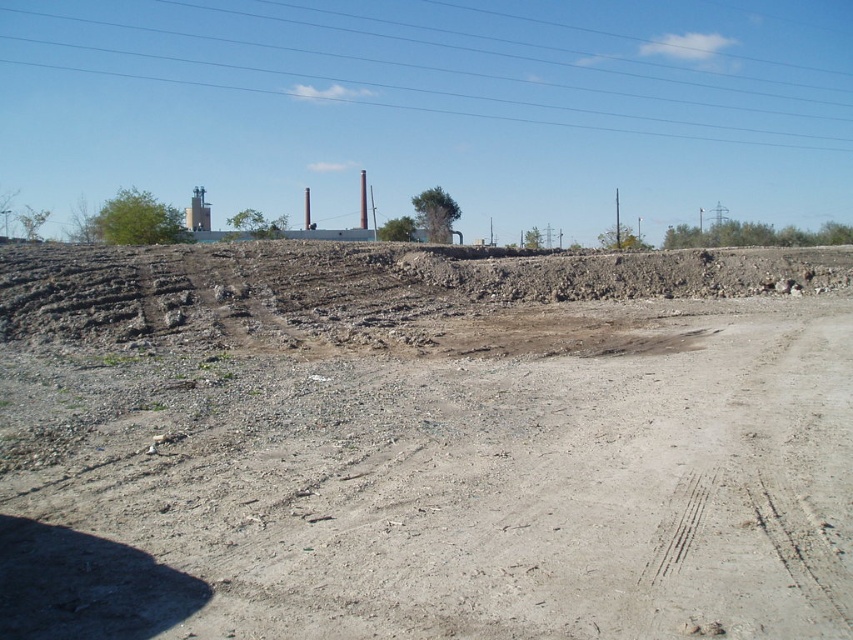
Is dull gray gravel at center smaller than clear blue sky at upper center?

Correct, dull gray gravel at center occupies less space than clear blue sky at upper center.

Does dull gray gravel at center appear on the left side of clear blue sky at upper center?

In fact, dull gray gravel at center is to the right of clear blue sky at upper center.

At what (x,y) coordinates should I click in order to perform the action: click on dull gray gravel at center. Please return your answer as a coordinate pair (x, y). This screenshot has width=853, height=640. Looking at the image, I should click on (424, 444).